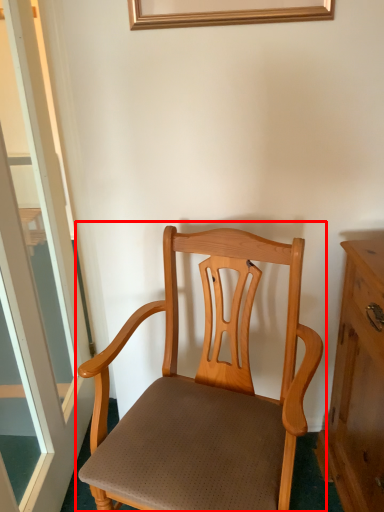
Question: From the image's perspective, where is chair (annotated by the red box) located in relation to window in the image?

Choices:
 (A) below
 (B) above

Answer: (A)